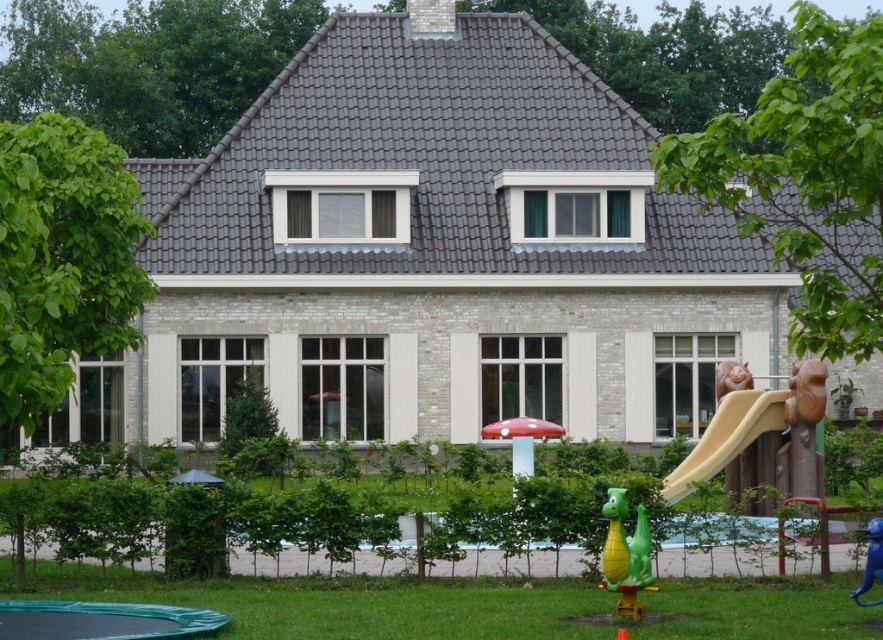
Question: Observing the image, what is the correct spatial positioning of smooth beige slide at right in reference to green rubber dragon at lower right?

Choices:
 (A) right
 (B) left

Answer: (A)

Question: Which object is farther from the camera taking this photo?

Choices:
 (A) blue plastic monkey at lower right
 (B) green rubber dragon at lower right
 (C) smooth beige slide at right

Answer: (C)

Question: Which object is the farthest from the green rubber dragon at lower right?

Choices:
 (A) smooth beige slide at right
 (B) blue plastic monkey at lower right

Answer: (A)

Question: Observing the image, what is the correct spatial positioning of green rubber dragon at lower right in reference to blue plastic monkey at lower right?

Choices:
 (A) above
 (B) below

Answer: (A)

Question: Which point is farther to the camera?

Choices:
 (A) (876, 518)
 (B) (751, 412)

Answer: (B)

Question: Is green rubber dragon at lower right closer to the viewer compared to blue plastic monkey at lower right?

Choices:
 (A) no
 (B) yes

Answer: (B)